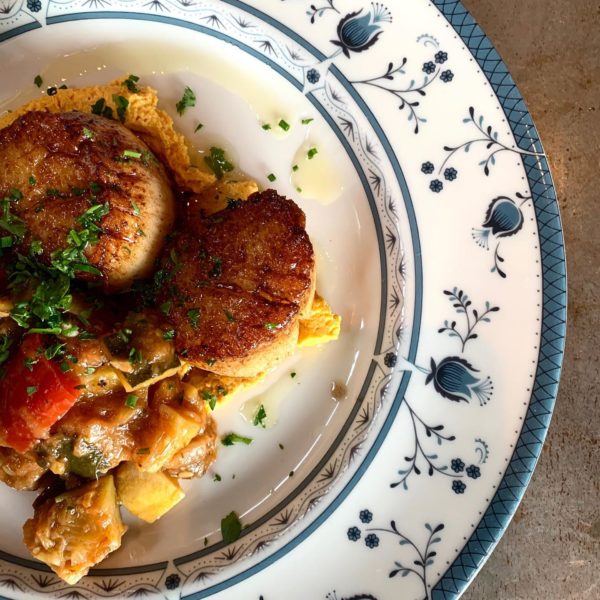
This screenshot has height=600, width=600. Identify the location of plate. (382, 491).